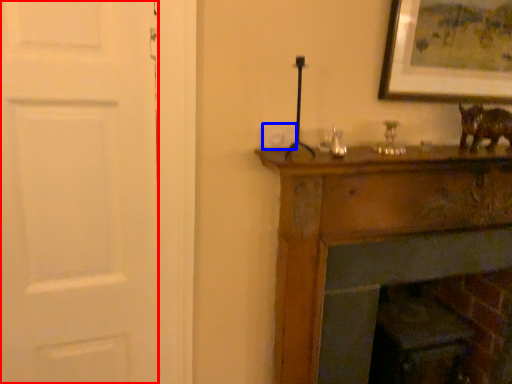
Question: Which point is further to the camera, door (highlighted by a red box) or light switch (highlighted by a blue box)?

Choices:
 (A) door
 (B) light switch

Answer: (B)